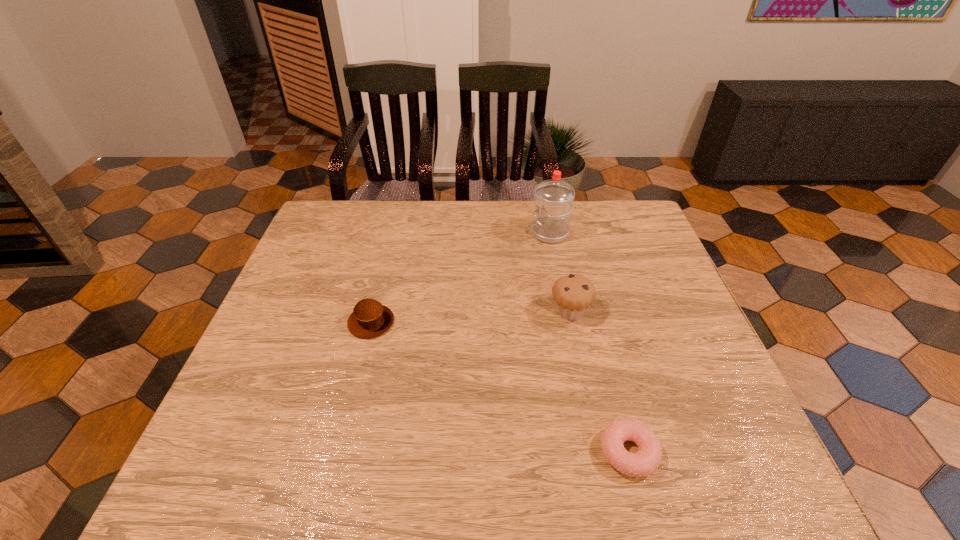
Locate an element on the screen. vacant space that is in between the third tallest object and the water bottle is located at coordinates (461, 278).

This screenshot has width=960, height=540. Find the location of `unoccupied area between the second tallest object and the tallest object`. unoccupied area between the second tallest object and the tallest object is located at coordinates (560, 273).

Where is `object identified as the closest to the farthest object`? The width and height of the screenshot is (960, 540). object identified as the closest to the farthest object is located at coordinates (573, 294).

I want to click on object that is the third closest one to the second shortest object, so click(x=646, y=461).

At what (x,y) coordinates should I click in order to perform the action: click on free space that satisfies the following two spatial constraints: 1. on the handle side of the taller muffin; 2. on the left side of the farthest object. Please return your answer as a coordinate pair (x, y). This screenshot has height=540, width=960. Looking at the image, I should click on (565, 312).

Locate an element on the screen. vacant space that satisfies the following two spatial constraints: 1. on the front side of the shortest object; 2. on the right side of the leftmost object is located at coordinates (339, 452).

This screenshot has width=960, height=540. Find the location of `vacant space that satisfies the following two spatial constraints: 1. on the handle side of the water bottle; 2. on the right side of the doughnut`. vacant space that satisfies the following two spatial constraints: 1. on the handle side of the water bottle; 2. on the right side of the doughnut is located at coordinates (592, 452).

Locate an element on the screen. Image resolution: width=960 pixels, height=540 pixels. free space that satisfies the following two spatial constraints: 1. on the handle side of the doughnut; 2. on the left side of the farthest object is located at coordinates click(x=592, y=452).

You are a GUI agent. You are given a task and a screenshot of the screen. Output one action in this format:
    pyautogui.click(x=<x>, y=<y>)
    Task: Click on the free space that satisfies the following two spatial constraints: 1. on the handle side of the tallest object; 2. on the right side of the third shortest object
    The height and width of the screenshot is (540, 960).
    Given the screenshot: What is the action you would take?
    pyautogui.click(x=565, y=312)

The width and height of the screenshot is (960, 540). In order to click on vacant space that satisfies the following two spatial constraints: 1. on the handle side of the right muffin; 2. on the left side of the water bottle in this screenshot , I will do `click(565, 312)`.